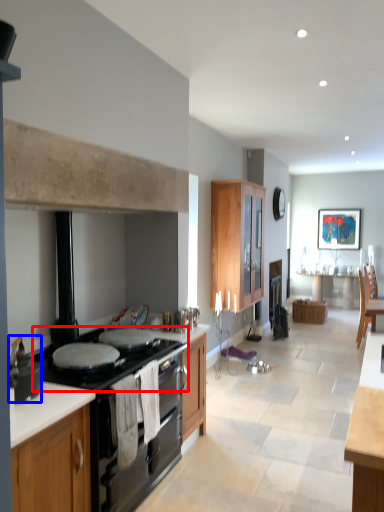
Question: Which object is further to the camera taking this photo, gas stove (highlighted by a red box) or pot/pan (highlighted by a blue box)?

Choices:
 (A) gas stove
 (B) pot/pan

Answer: (A)